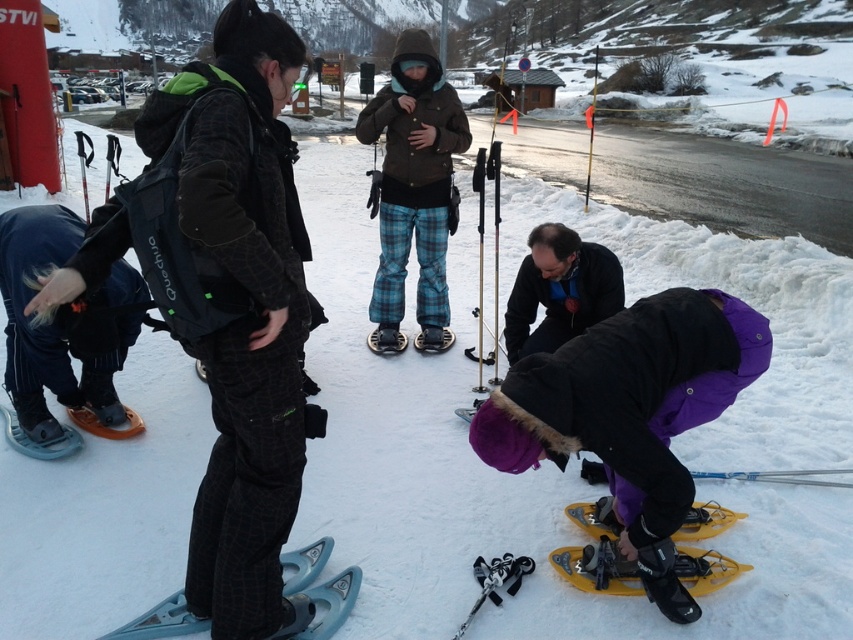
Question: Is black matte snowshoes at lower left above matte black snowshoe at lower left?

Choices:
 (A) no
 (B) yes

Answer: (B)

Question: Which of the following is the farthest from the observer?

Choices:
 (A) pyautogui.click(x=618, y=524)
 (B) pyautogui.click(x=515, y=566)
 (C) pyautogui.click(x=131, y=422)
 (D) pyautogui.click(x=312, y=545)

Answer: (C)

Question: Does metallic ski pole at center appear on the right side of matte black snowshoe at lower left?

Choices:
 (A) yes
 (B) no

Answer: (A)

Question: Which point is closer to the camera?

Choices:
 (A) (595, 264)
 (B) (68, 328)

Answer: (B)

Question: Which point is closer to the camera?

Choices:
 (A) matte black snowshoe at lower left
 (B) purple fleece jacket at lower center
 (C) yellow plastic snowshoe at lower center

Answer: (C)

Question: Is purple fleece jacket at lower right to the left of black matte snowshoes at lower left from the viewer's perspective?

Choices:
 (A) yes
 (B) no

Answer: (B)